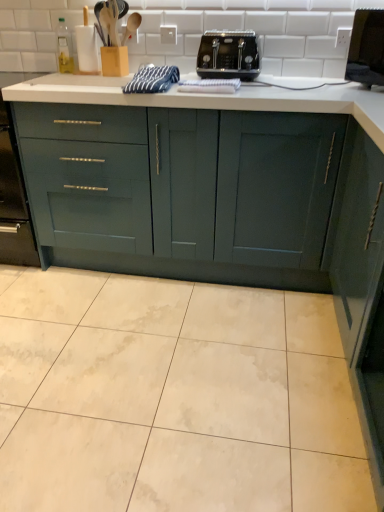
I want to click on vacant region to the left of blue striped towel at center, so click(x=77, y=85).